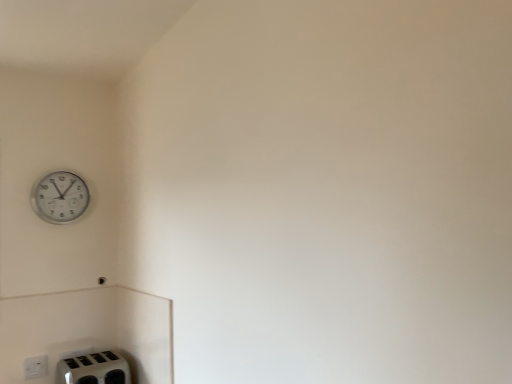
This screenshot has height=384, width=512. Describe the element at coordinates (93, 369) in the screenshot. I see `white plastic toaster at lower left` at that location.

I want to click on white plastic toaster at lower left, so click(x=93, y=369).

From the picture: Which is less distant, (111, 373) or (86, 208)?

Point (111, 373).

Based on the photo, is white plastic toaster at lower left smaller than white plastic wall clock at upper left?

No, white plastic toaster at lower left is not smaller than white plastic wall clock at upper left.

Is white plastic toaster at lower left aimed at white plastic wall clock at upper left?

No, white plastic toaster at lower left is not turned towards white plastic wall clock at upper left.

Is point (32, 359) closer or farther from the camera than point (59, 197)?

Point (32, 359).

Based on the photo, from a real-world perspective, which object rests below the other?

white plastic electric outlet at lower left is physically lower.

From the image's perspective, is white plastic electric outlet at lower left positioned above or below white plastic wall clock at upper left?

From the image's perspective, white plastic electric outlet at lower left appears below white plastic wall clock at upper left.

How many degrees apart are the facing directions of white plastic electric outlet at lower left and white plastic wall clock at upper left?

white plastic electric outlet at lower left and white plastic wall clock at upper left are facing 3.72 degrees away from each other.

Is white plastic toaster at lower left taller or shorter than white plastic electric outlet at lower left?

Clearly, white plastic toaster at lower left is taller compared to white plastic electric outlet at lower left.

Does white plastic toaster at lower left have a smaller size compared to white plastic electric outlet at lower left?

No, white plastic toaster at lower left is not smaller than white plastic electric outlet at lower left.

Would you say white plastic toaster at lower left is outside white plastic electric outlet at lower left?

Indeed, white plastic toaster at lower left is completely outside white plastic electric outlet at lower left.

How much distance is there between white plastic toaster at lower left and white plastic electric outlet at lower left?

They are 7.32 inches apart.

Based on their positions, is white plastic electric outlet at lower left located to the left or right of white plastic toaster at lower left?

white plastic electric outlet at lower left is positioned on white plastic toaster at lower left's left side.

From the image's perspective, does white plastic electric outlet at lower left appear higher than white plastic toaster at lower left?

Correct, white plastic electric outlet at lower left appears higher than white plastic toaster at lower left in the image.

Considering the sizes of objects white plastic electric outlet at lower left and white plastic toaster at lower left in the image provided, who is thinner, white plastic electric outlet at lower left or white plastic toaster at lower left?

white plastic electric outlet at lower left.

Does point (67, 208) come in front of point (30, 374)?

That is False.

Considering the sizes of objects white plastic wall clock at upper left and white plastic electric outlet at lower left in the image provided, who is smaller, white plastic wall clock at upper left or white plastic electric outlet at lower left?

white plastic electric outlet at lower left.

Is white plastic electric outlet at lower left a part of white plastic wall clock at upper left?

No, white plastic electric outlet at lower left is located outside of white plastic wall clock at upper left.

Is white plastic wall clock at upper left positioned with its back to white plastic electric outlet at lower left?

That's not correct — white plastic wall clock at upper left is not looking away from white plastic electric outlet at lower left.

Considering the relative sizes of white plastic wall clock at upper left and white plastic toaster at lower left in the image provided, is white plastic wall clock at upper left taller than white plastic toaster at lower left?

Yes.

Identify the location of wall clock above the white plastic toaster at lower left (from a real-world perspective). (60, 197).

Can you confirm if white plastic wall clock at upper left is smaller than white plastic toaster at lower left?

Indeed, white plastic wall clock at upper left has a smaller size compared to white plastic toaster at lower left.

From a real-world perspective, which object stands above the other?

white plastic wall clock at upper left is physically above.

In the image, there is a white plastic toaster at lower left. Where is `wall clock above it (from the image's perspective)`? wall clock above it (from the image's perspective) is located at coordinates (60, 197).

In order to click on electric outlet that appears in front of the white plastic wall clock at upper left in this screenshot , I will do `click(35, 367)`.

Considering their positions, is white plastic toaster at lower left positioned further to white plastic electric outlet at lower left than white plastic wall clock at upper left?

white plastic wall clock at upper left.

Based on their spatial positions, is white plastic electric outlet at lower left or white plastic wall clock at upper left closer to white plastic toaster at lower left?

Among the two, white plastic electric outlet at lower left is located nearer to white plastic toaster at lower left.

From the picture: When comparing their distances from white plastic toaster at lower left, does white plastic wall clock at upper left or white plastic electric outlet at lower left seem further?

white plastic wall clock at upper left lies further to white plastic toaster at lower left than the other object.

From the image, which object appears to be farther from white plastic wall clock at upper left, white plastic toaster at lower left or white plastic electric outlet at lower left?

Among the two, white plastic toaster at lower left is located further to white plastic wall clock at upper left.

Which object lies further to the anchor point white plastic wall clock at upper left, white plastic electric outlet at lower left or white plastic toaster at lower left?

white plastic toaster at lower left is positioned further to the anchor white plastic wall clock at upper left.

From the image, which object appears to be nearer to white plastic electric outlet at lower left, white plastic wall clock at upper left or white plastic toaster at lower left?

white plastic toaster at lower left.

Find the location of a particular element. electric outlet between white plastic wall clock at upper left and white plastic toaster at lower left in the vertical direction is located at coordinates [x=35, y=367].